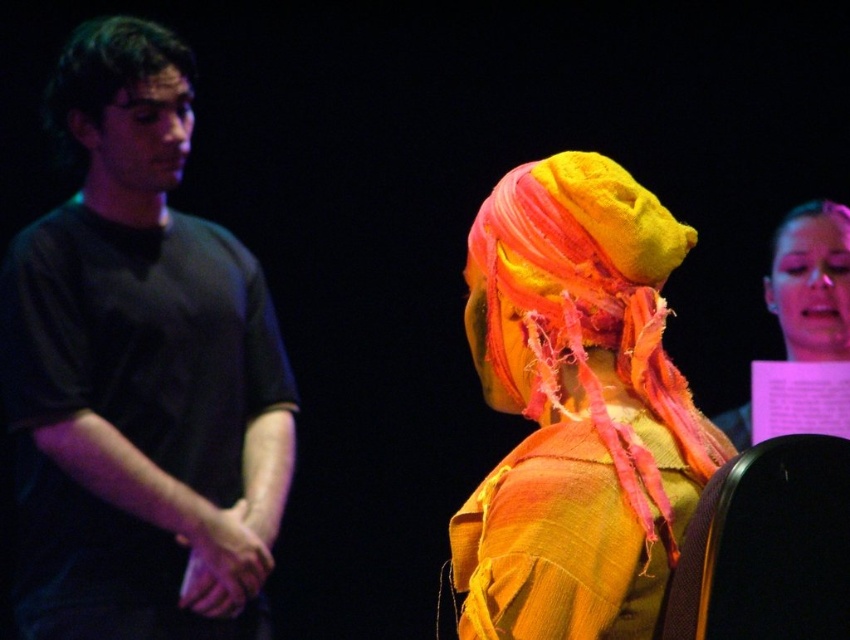
Is textured yellow-orange scarf at center to the right of matte yellow fabric headscarf at upper right from the viewer's perspective?

No, textured yellow-orange scarf at center is not to the right of matte yellow fabric headscarf at upper right.

Can you confirm if textured yellow-orange scarf at center is bigger than matte yellow fabric headscarf at upper right?

Yes.

I want to click on textured yellow-orange scarf at center, so click(x=576, y=406).

Looking at this image, is black matte shirt at left positioned in front of matte yellow fabric headscarf at upper right?

Yes, black matte shirt at left is in front of matte yellow fabric headscarf at upper right.

Is black matte shirt at left shorter than matte yellow fabric headscarf at upper right?

No.

Does point (49, 492) come closer to viewer compared to point (774, 304)?

Yes, point (49, 492) is in front of point (774, 304).

Locate an element on the screen. black matte shirt at left is located at coordinates (139, 372).

Looking at this image, can you confirm if black matte shirt at left is thinner than textured yellow-orange scarf at center?

No.

Is point (156, 484) positioned after point (615, 288)?

Yes, point (156, 484) is behind point (615, 288).

Where is `black matte shirt at left`? black matte shirt at left is located at coordinates [139, 372].